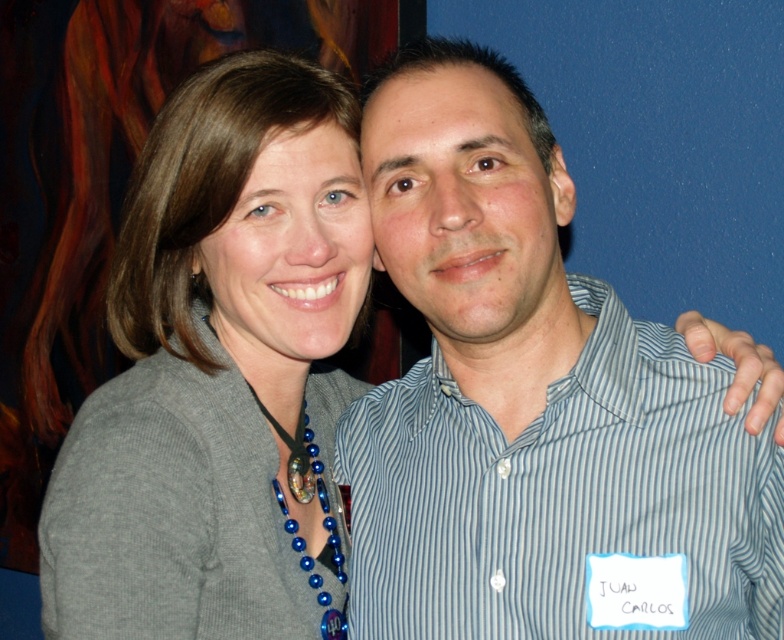
Which is in front, point (625, 472) or point (280, 432)?

Point (625, 472)

Who is positioned more to the left, blue striped shirt at center or gray knitted sweater at upper left?

Positioned to the left is gray knitted sweater at upper left.

Who is more distant from viewer, (492, 627) or (73, 548)?

The point (492, 627) is more distant.

You are a GUI agent. You are given a task and a screenshot of the screen. Output one action in this format:
    pyautogui.click(x=<x>, y=<y>)
    Task: Click on the blue striped shirt at center
    
    Given the screenshot: What is the action you would take?
    pyautogui.click(x=532, y=403)